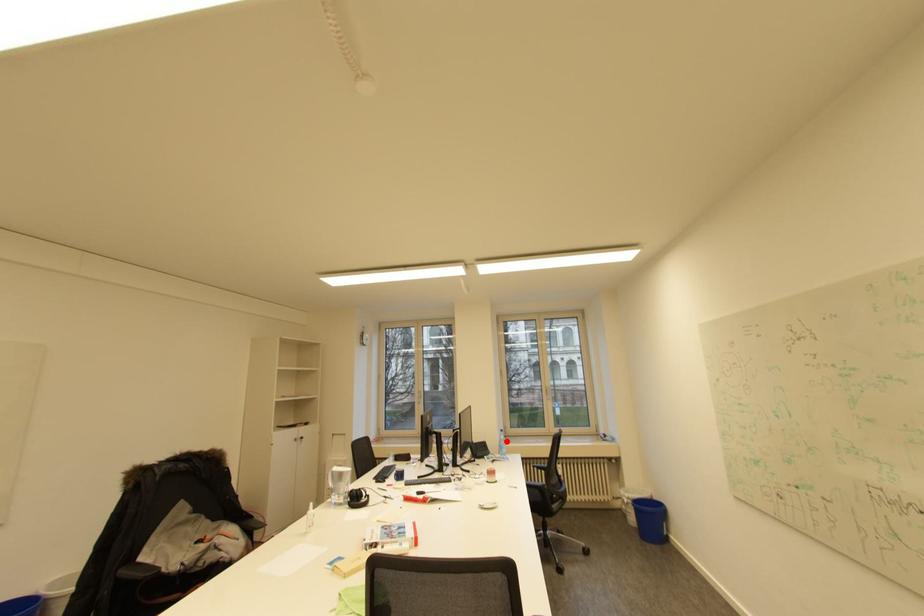
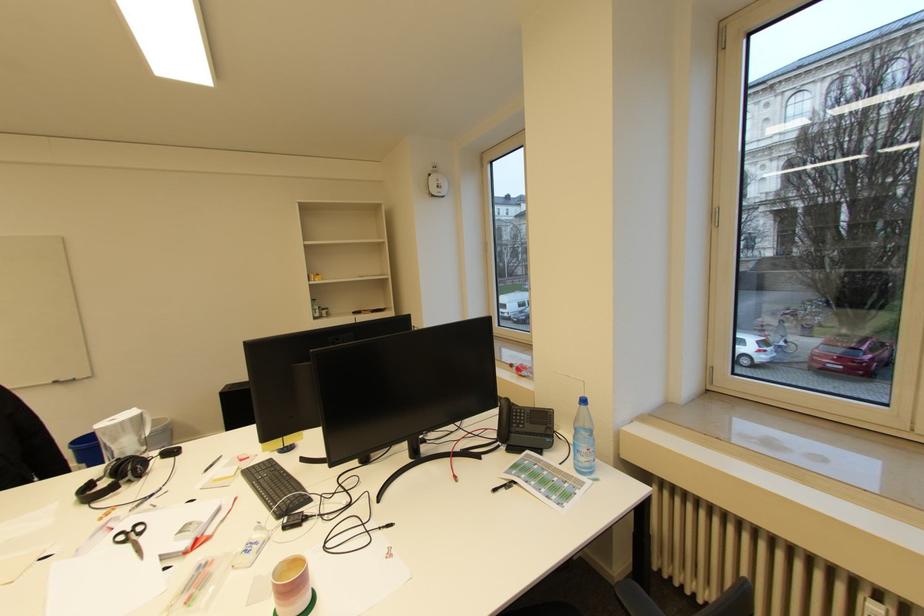
In the second image, find the point that corresponds to the highlighted location in the first image.

(581, 429)